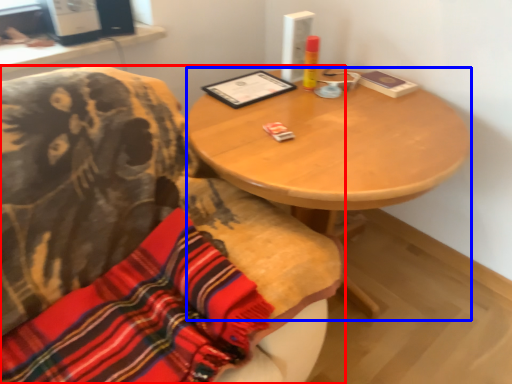
Question: Which object appears closest to the camera in this image, chair (highlighted by a red box) or desk (highlighted by a blue box)?

Choices:
 (A) chair
 (B) desk

Answer: (A)